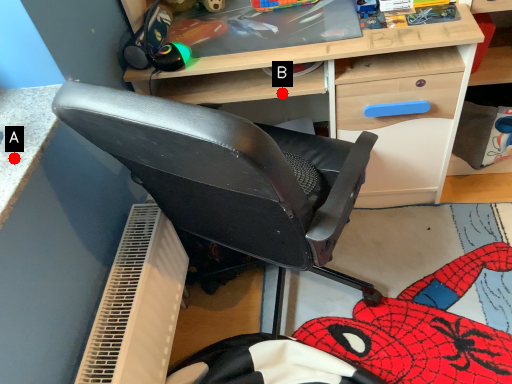
Question: Two points are circled on the image, labeled by A and B beside each circle. Which point is further to the camera?

Choices:
 (A) A is further
 (B) B is further

Answer: (B)